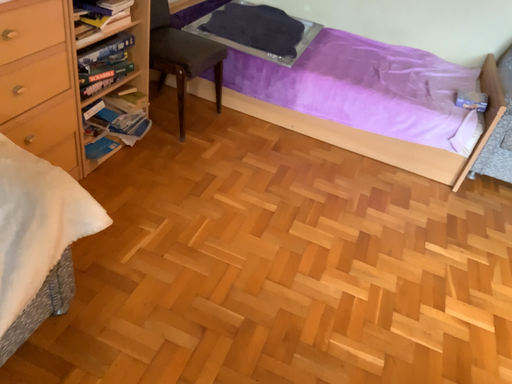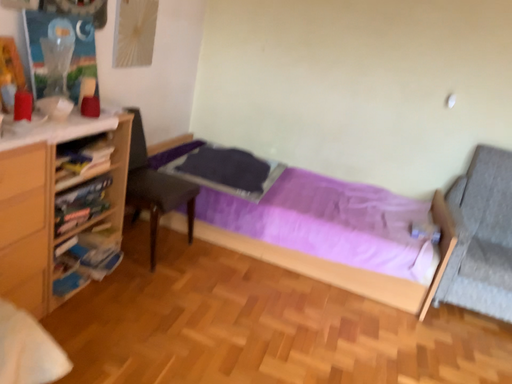
Question: Which way did the camera rotate in the video?

Choices:
 (A) rotated downward
 (B) rotated upward

Answer: (B)